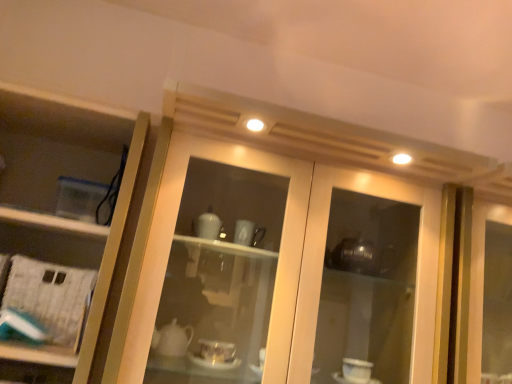
Question: Is white paper at left closer to camera compared to matte glass cabinet at center?

Choices:
 (A) no
 (B) yes

Answer: (A)

Question: Is white paper at left wider than matte glass cabinet at center?

Choices:
 (A) yes
 (B) no

Answer: (B)

Question: Considering the relative sizes of white paper at left and matte glass cabinet at center in the image provided, is white paper at left shorter than matte glass cabinet at center?

Choices:
 (A) yes
 (B) no

Answer: (A)

Question: Is white paper at left turned away from matte glass cabinet at center?

Choices:
 (A) no
 (B) yes

Answer: (A)

Question: Can you confirm if white paper at left is smaller than matte glass cabinet at center?

Choices:
 (A) no
 (B) yes

Answer: (B)

Question: From the image's perspective, is white paper at left under matte glass cabinet at center?

Choices:
 (A) no
 (B) yes

Answer: (B)

Question: Can you confirm if clear plastic container at left is positioned to the right of white paper at left?

Choices:
 (A) yes
 (B) no

Answer: (B)

Question: Can you confirm if clear plastic container at left is positioned to the left of white paper at left?

Choices:
 (A) no
 (B) yes

Answer: (B)

Question: Is clear plastic container at left facing towards white paper at left?

Choices:
 (A) no
 (B) yes

Answer: (B)

Question: Is clear plastic container at left thinner than white paper at left?

Choices:
 (A) yes
 (B) no

Answer: (B)

Question: From a real-world perspective, is clear plastic container at left under white paper at left?

Choices:
 (A) yes
 (B) no

Answer: (B)

Question: Does clear plastic container at left have a larger size compared to white paper at left?

Choices:
 (A) no
 (B) yes

Answer: (B)

Question: Would you say clear plastic container at left is part of matte glass cabinet at center's contents?

Choices:
 (A) yes
 (B) no

Answer: (B)